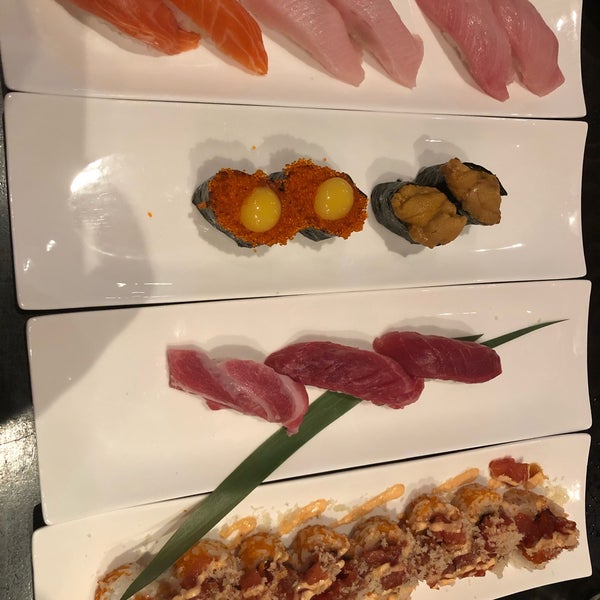
At what (x,y) coordinates should I click in order to perform the action: click on table. Please return your answer as a coordinate pair (x, y). This screenshot has width=600, height=600. Looking at the image, I should click on (24, 450).